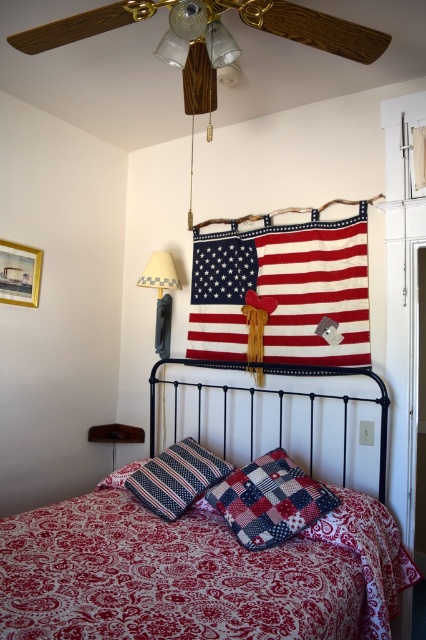
Is point (23, 51) positioned behind point (181, 19)?

That is True.

Which is behind, point (94, 28) or point (170, 35)?

The point (94, 28) is behind.

In order to click on wooden ceiling fan at upper center in this screenshot , I will do `click(310, 28)`.

Is red paisley fabric bed at center below matte glass lamp at upper center?

Indeed, red paisley fabric bed at center is positioned under matte glass lamp at upper center.

Who is taller, red paisley fabric bed at center or matte glass lamp at upper center?

With more height is red paisley fabric bed at center.

I want to click on red paisley fabric bed at center, so click(x=196, y=573).

Find the location of `red paisley fabric bed at center`. red paisley fabric bed at center is located at coordinates (196, 573).

Who is more distant from viewer, (118, 506) or (379, 486)?

Positioned behind is point (118, 506).

The image size is (426, 640). Describe the element at coordinates (196, 573) in the screenshot. I see `red paisley fabric bed at center` at that location.

Identify the location of red paisley fabric bed at center. (196, 573).